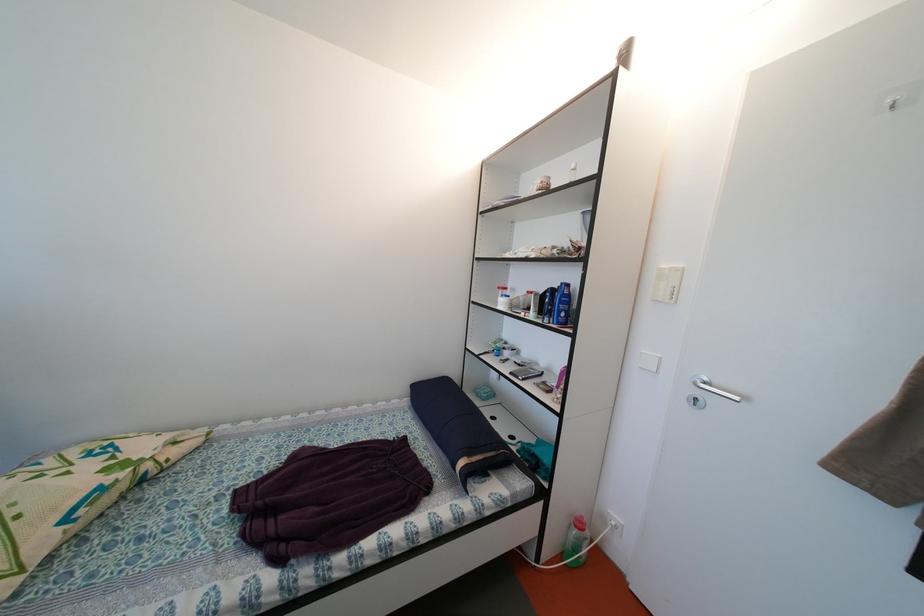
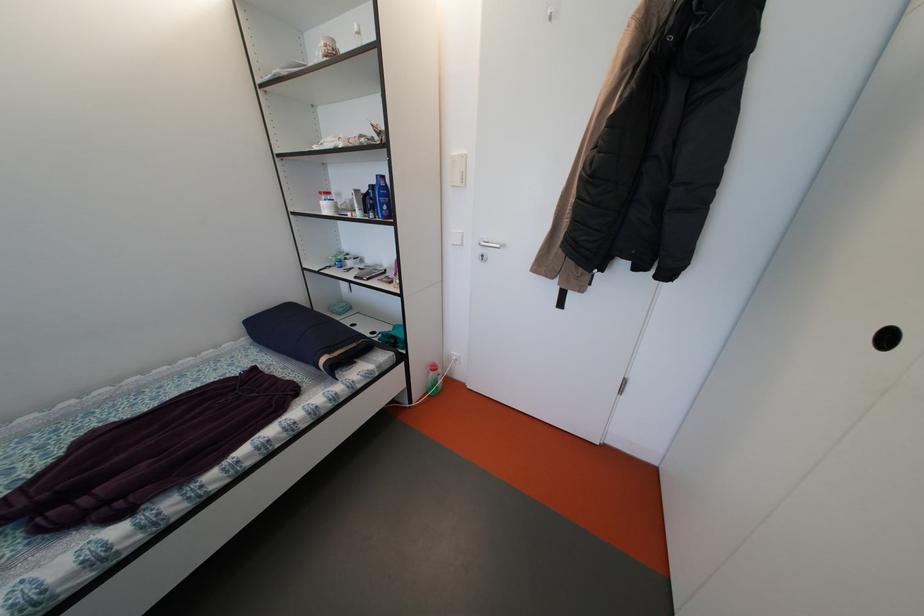
In the second image, find the point that corresponds to pixel 713 384 in the first image.

(493, 245)